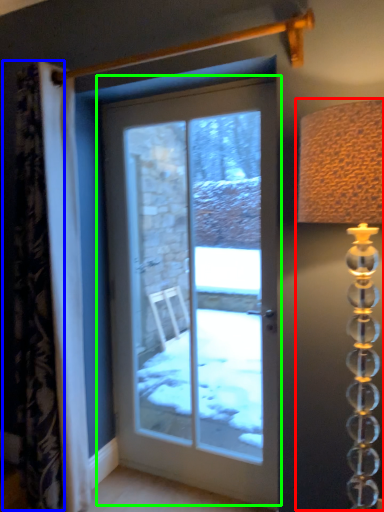
Question: Estimate the real-world distances between objects in this image. Which object is farther from table lamp (highlighted by a red box), curtain (highlighted by a blue box) or door (highlighted by a green box)?

Choices:
 (A) curtain
 (B) door

Answer: (B)